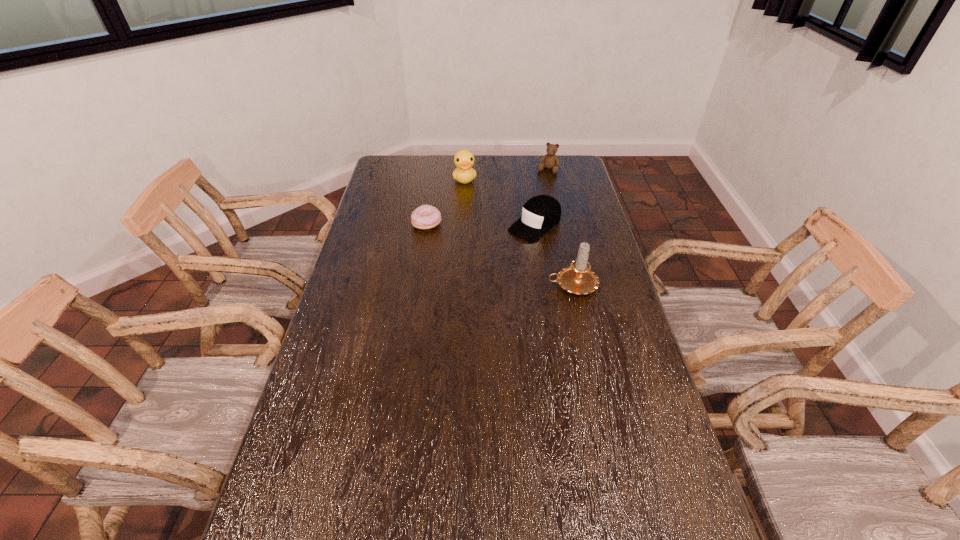
In order to click on duck present at the far edge in this screenshot , I will do `click(464, 173)`.

This screenshot has width=960, height=540. I want to click on candle that is at the right edge, so click(x=578, y=278).

The image size is (960, 540). In order to click on teddy bear at the right edge in this screenshot , I will do `click(551, 161)`.

Locate an element on the screen. cap that is at the right edge is located at coordinates (541, 213).

The height and width of the screenshot is (540, 960). Find the location of `object present at the far right corner`. object present at the far right corner is located at coordinates (551, 161).

In the image, there is a desktop. At what (x,y) coordinates should I click in order to perform the action: click on vacant space at the far edge. Please return your answer as a coordinate pair (x, y). The image size is (960, 540). Looking at the image, I should click on click(x=444, y=161).

At what (x,y) coordinates should I click in order to perform the action: click on free space at the left edge of the desktop. Please return your answer as a coordinate pair (x, y). The width and height of the screenshot is (960, 540). Looking at the image, I should click on (278, 480).

I want to click on free space at the right edge, so click(584, 218).

Locate an element on the screen. vacant space at the far right corner of the desktop is located at coordinates (567, 166).

Locate an element on the screen. Image resolution: width=960 pixels, height=540 pixels. free space between the shortest object and the tallest object is located at coordinates (499, 254).